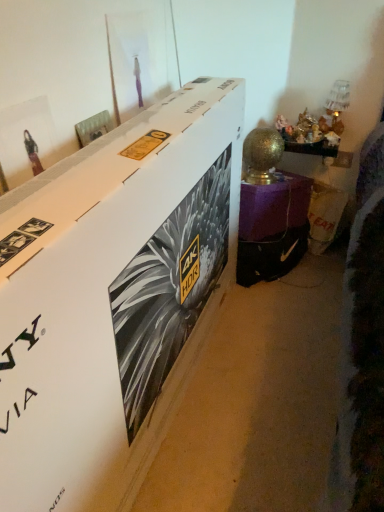
Locate an element on the screen. The width and height of the screenshot is (384, 512). white cardboard box at center is located at coordinates (113, 297).

What do you see at coordinates (113, 297) in the screenshot? I see `white cardboard box at center` at bounding box center [113, 297].

The image size is (384, 512). I want to click on white cardboard box at center, so click(x=113, y=297).